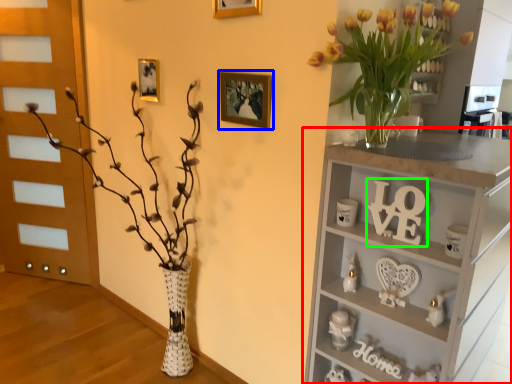
Question: Which is farther away from shelf (highlighted by a red box)? picture frame (highlighted by a blue box) or number (highlighted by a green box)?

Choices:
 (A) picture frame
 (B) number

Answer: (A)